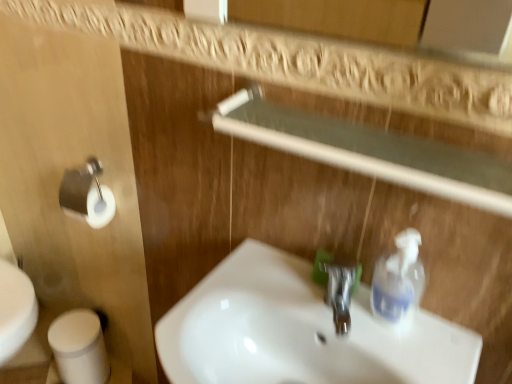
This screenshot has width=512, height=384. What are the coordinates of `free space above white matte toilet paper at lower left (from a real-world perspective)` in the screenshot? It's located at (76, 328).